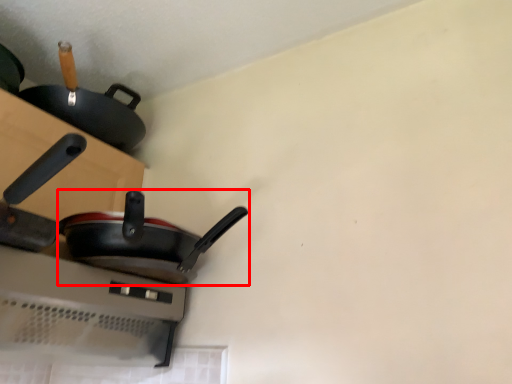
Question: From the image's perspective, considering the relative positions of frying pan (annotated by the red box) and frying pan in the image provided, where is frying pan (annotated by the red box) located with respect to the staircase?

Choices:
 (A) above
 (B) below

Answer: (B)